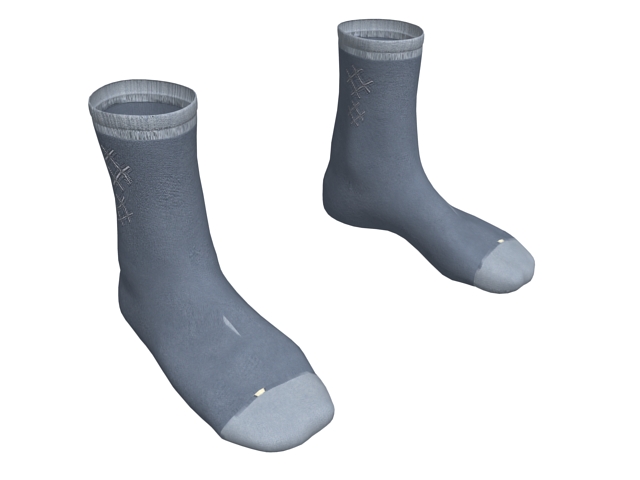
Image resolution: width=640 pixels, height=480 pixels. I want to click on left sock, so click(406, 149).